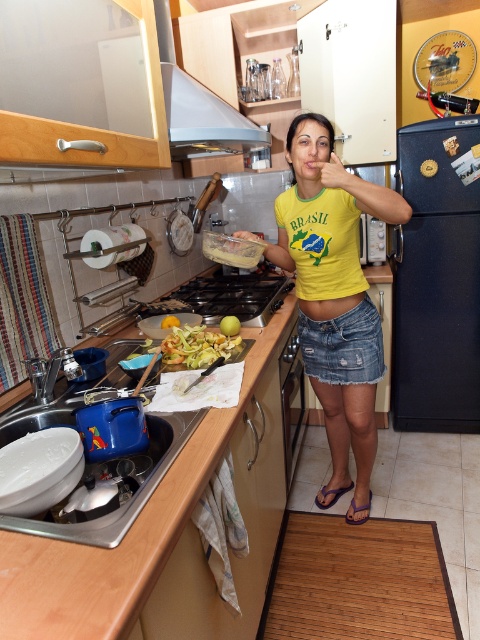
Question: Is woodenmaterial/texturecounter top at center above denim skirt at center?

Choices:
 (A) yes
 (B) no

Answer: (B)

Question: Where is woodenmaterial/texturecounter top at center located in relation to yellowish matte vegetables at center in the image?

Choices:
 (A) below
 (B) above

Answer: (A)

Question: Is denim skirt at center below yellowish matte vegetables at center?

Choices:
 (A) no
 (B) yes

Answer: (B)

Question: Which object is closer to the camera taking this photo?

Choices:
 (A) yellowish matte vegetables at center
 (B) yellow cotton shirt at center

Answer: (A)

Question: Which is farther from the yellowish matte vegetables at center?

Choices:
 (A) silver metallic exhaust hood at upper center
 (B) yellow cotton shirt at center
 (C) denim skirt at center

Answer: (A)

Question: Based on their relative distances, which object is farther from the denim skirt at center?

Choices:
 (A) yellowish matte vegetables at center
 (B) woodenmaterial/texturecounter top at center
 (C) silver metallic exhaust hood at upper center

Answer: (C)